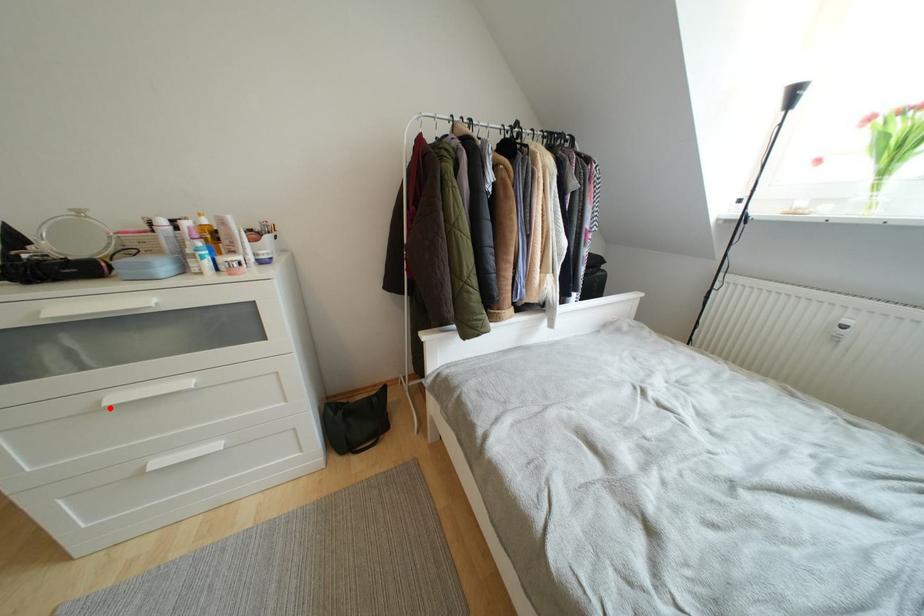
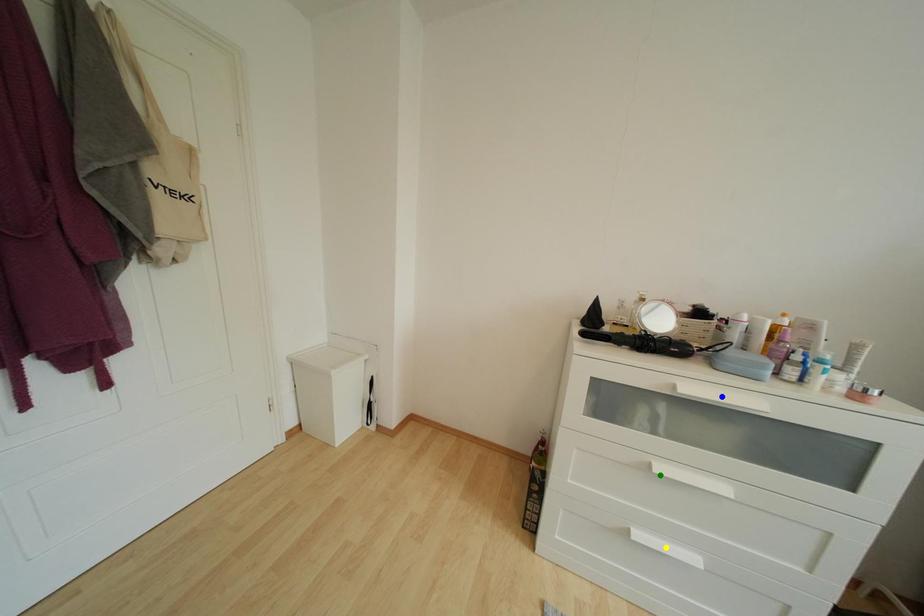
Question: I am providing you with two images of the same scene from different viewpoints. A red point is marked on the first image. You are given multiple points on the second image. Which point in image 2 is actually the same real-world point as the red point in image 1?

Choices:
 (A) yellow point
 (B) green point
 (C) blue point

Answer: (B)